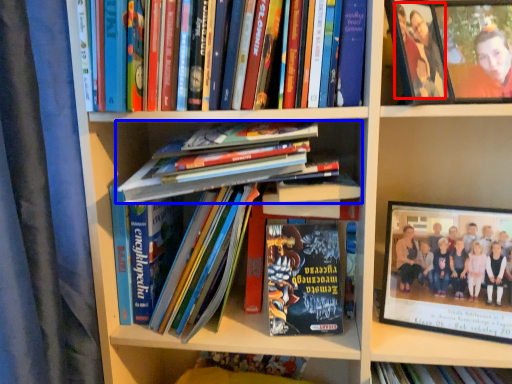
Question: Which point is closer to the camera, person (highlighted by a red box) or book (highlighted by a blue box)?

Choices:
 (A) person
 (B) book

Answer: (A)